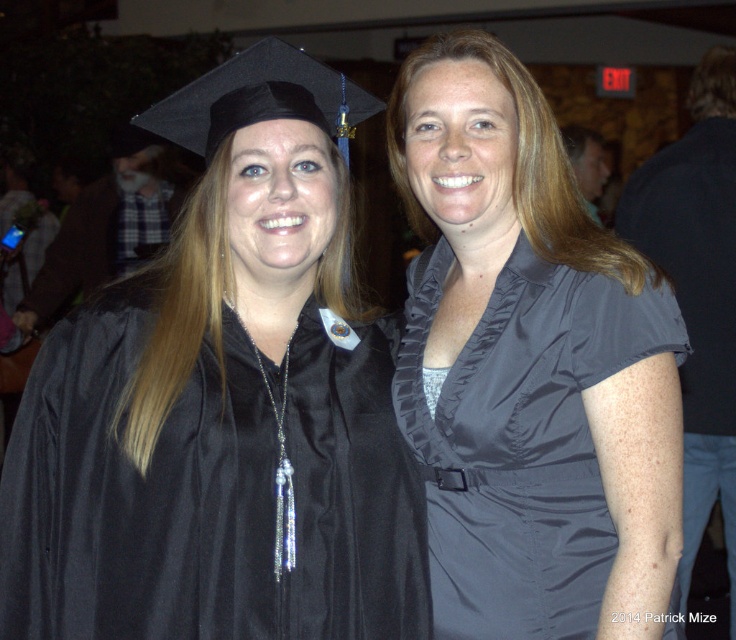
You are a photographer taking a photo of two women. The women are wearing the matte black graduation gown at center and the black satin robe at right. Based on their positions, which one is standing to the left of the other?

The matte black graduation gown at center is positioned on the left side of the black satin robe at right, so the matte black graduation gown at center is to the left of the black satin robe at right.

You are a photographer setting up for a group photo. You need to position yourself so that both the satin gray blouse at center and the black satin robe at right are in focus. Which object should you focus on first to ensure both are sharp?

You should focus on the satin gray blouse at center first since it is closer to the viewer, ensuring both it and the black satin robe at right will be in focus.